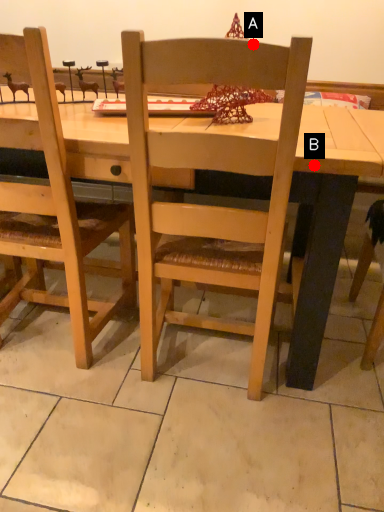
Question: Two points are circled on the image, labeled by A and B beside each circle. Which point is closer to the camera taking this photo?

Choices:
 (A) A is closer
 (B) B is closer

Answer: (A)